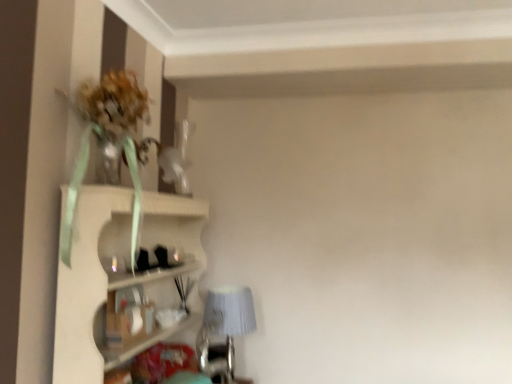
In order to face textured gray lampshade at lower center, should I rotate leftwards or rightwards?

You should look left and rotate roughly 2.755 degrees.

What do you see at coordinates (224, 327) in the screenshot? The height and width of the screenshot is (384, 512). I see `textured gray lampshade at lower center` at bounding box center [224, 327].

At what (x,y) coordinates should I click in order to perform the action: click on textured gray lampshade at lower center. Please return your answer as a coordinate pair (x, y). Looking at the image, I should click on (224, 327).

Identify the location of white textured shelf at upper left. This screenshot has width=512, height=384. (120, 274).

Image resolution: width=512 pixels, height=384 pixels. What do you see at coordinates (120, 274) in the screenshot? I see `white textured shelf at upper left` at bounding box center [120, 274].

You are a GUI agent. You are given a task and a screenshot of the screen. Output one action in this format:
    pyautogui.click(x=<x>, y=<y>)
    Task: Click on the textured gray lampshade at lower center
    This screenshot has width=512, height=384.
    Given the screenshot: What is the action you would take?
    pyautogui.click(x=224, y=327)

Considering the relative positions of textured gray lampshade at lower center and white textured shelf at upper left in the image provided, is textured gray lampshade at lower center to the left or to the right of white textured shelf at upper left?

From the image, it's evident that textured gray lampshade at lower center is to the right of white textured shelf at upper left.

Who is more distant, textured gray lampshade at lower center or white textured shelf at upper left?

textured gray lampshade at lower center is further from the camera.

Is point (243, 301) closer to viewer compared to point (85, 258)?

No, it is behind (85, 258).

Based on the photo, from the image's perspective, is textured gray lampshade at lower center located above white textured shelf at upper left?

Incorrect, from the image's perspective, textured gray lampshade at lower center is lower than white textured shelf at upper left.

From a real-world perspective, does textured gray lampshade at lower center sit lower than white textured shelf at upper left?

Yes, from a real-world perspective, textured gray lampshade at lower center is under white textured shelf at upper left.

Based on the photo, between textured gray lampshade at lower center and white textured shelf at upper left, which one has smaller width?

With smaller width is textured gray lampshade at lower center.

Does textured gray lampshade at lower center have a lesser height compared to white textured shelf at upper left?

Indeed, textured gray lampshade at lower center has a lesser height compared to white textured shelf at upper left.

Is textured gray lampshade at lower center smaller than white textured shelf at upper left?

Correct, textured gray lampshade at lower center occupies less space than white textured shelf at upper left.

Would you say white textured shelf at upper left is part of textured gray lampshade at lower center's contents?

That's incorrect, white textured shelf at upper left is not inside textured gray lampshade at lower center.

Are textured gray lampshade at lower center and white textured shelf at upper left located far from each other?

No.

Is textured gray lampshade at lower center facing away from white textured shelf at upper left?

Correct, textured gray lampshade at lower center is looking away from white textured shelf at upper left.

Can you tell me how much textured gray lampshade at lower center and white textured shelf at upper left differ in facing direction?

The facing directions of textured gray lampshade at lower center and white textured shelf at upper left are 0.00162 degrees apart.

The image size is (512, 384). Identify the location of shelf located above the textured gray lampshade at lower center (from the image's perspective). (120, 274).

Is white textured shelf at upper left at the right side of textured gray lampshade at lower center?

Incorrect, white textured shelf at upper left is not on the right side of textured gray lampshade at lower center.

Which object is closer to the camera, white textured shelf at upper left or textured gray lampshade at lower center?

white textured shelf at upper left is more forward.

Considering the positions of points (82, 309) and (218, 330), is point (82, 309) farther from camera compared to point (218, 330)?

No, it is not.

Consider the image. From the image's perspective, would you say white textured shelf at upper left is shown under textured gray lampshade at lower center?

No, from the image's perspective, white textured shelf at upper left is not below textured gray lampshade at lower center.

In the scene shown: From a real-world perspective, which is physically above, white textured shelf at upper left or textured gray lampshade at lower center?

white textured shelf at upper left is physically above.

Looking at their sizes, would you say white textured shelf at upper left is wider or thinner than textured gray lampshade at lower center?

Considering their sizes, white textured shelf at upper left looks broader than textured gray lampshade at lower center.

Who is taller, white textured shelf at upper left or textured gray lampshade at lower center?

With more height is white textured shelf at upper left.

Can you confirm if white textured shelf at upper left is bigger than textured gray lampshade at lower center?

Indeed, white textured shelf at upper left has a larger size compared to textured gray lampshade at lower center.

Is textured gray lampshade at lower center inside white textured shelf at upper left?

Yes, textured gray lampshade at lower center is surrounded by white textured shelf at upper left.

Is white textured shelf at upper left next to textured gray lampshade at lower center and touching it?

No, white textured shelf at upper left is not with textured gray lampshade at lower center.

Is textured gray lampshade at lower center at the back of white textured shelf at upper left?

Absolutely, white textured shelf at upper left is directed away from textured gray lampshade at lower center.

Can you tell me how much white textured shelf at upper left and textured gray lampshade at lower center differ in facing direction?

The angular difference between white textured shelf at upper left and textured gray lampshade at lower center is 0.00162 degrees.

How far apart are white textured shelf at upper left and textured gray lampshade at lower center?

They are 15.95 inches apart.

The width and height of the screenshot is (512, 384). In order to click on shelf that is above the textured gray lampshade at lower center (from a real-world perspective) in this screenshot , I will do `click(120, 274)`.

The height and width of the screenshot is (384, 512). Identify the location of shelf in front of the textured gray lampshade at lower center. tap(120, 274).

Locate an element on the screen. table lamp below the white textured shelf at upper left (from the image's perspective) is located at coordinates (224, 327).